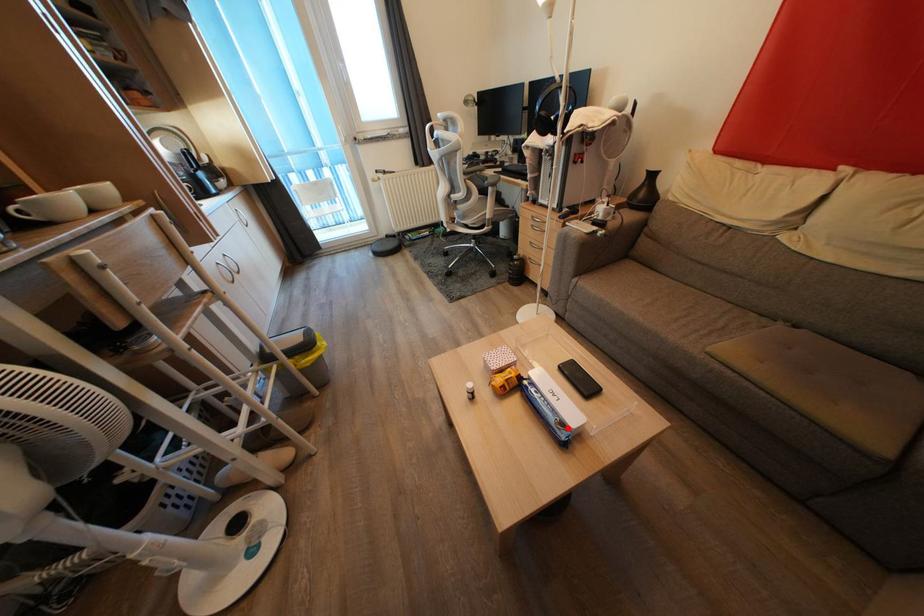
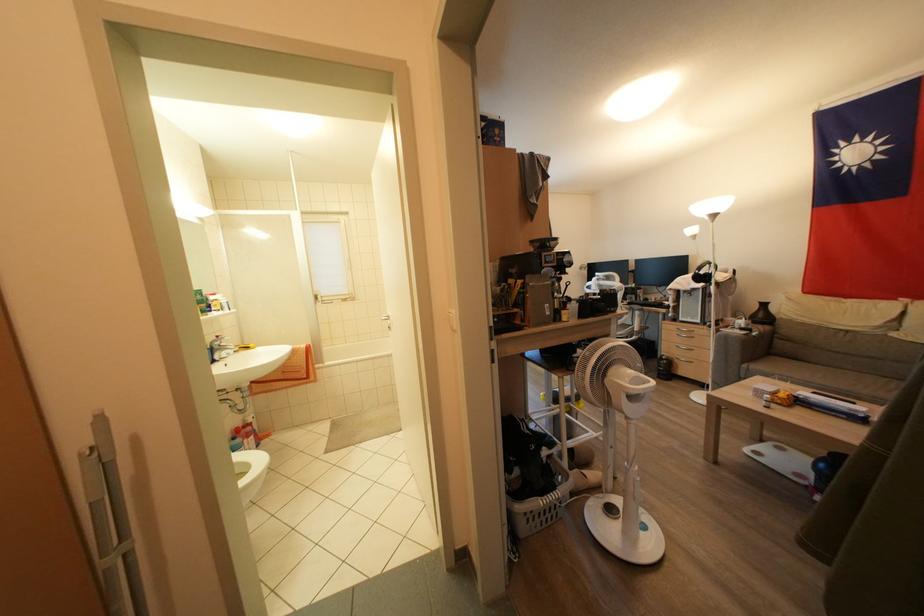
Question: I am providing you with two images of the same scene from different viewpoints. In image1, a red point is highlighted. Considering the same 3D point in image2, which of the following is correct?

Choices:
 (A) It is closer
 (B) It is farther

Answer: (B)